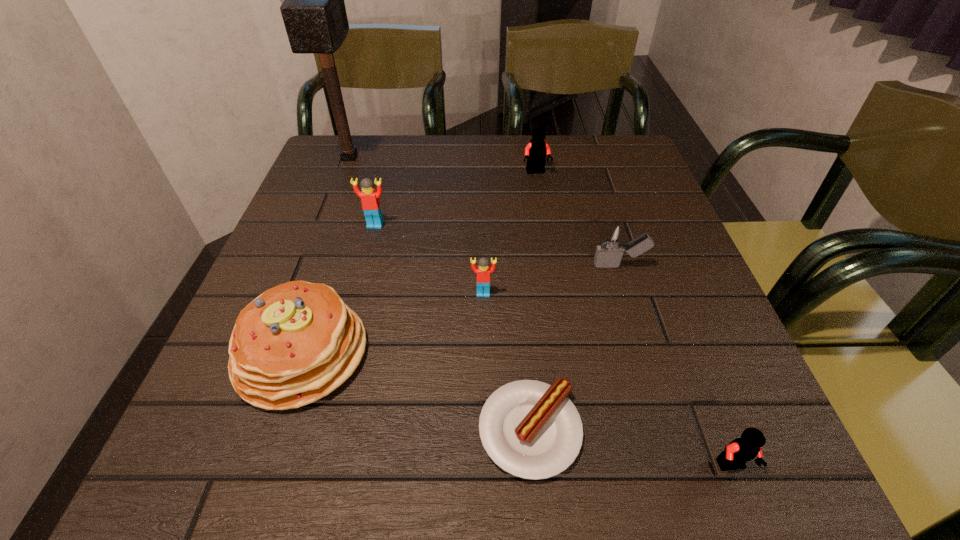
Identify the location of free area in between the igniter and the mallet. (485, 212).

Locate an element on the screen. vacant area between the gray igniter and the shortest object is located at coordinates (575, 348).

The height and width of the screenshot is (540, 960). Find the location of `the sixth closest object relative to the mallet`. the sixth closest object relative to the mallet is located at coordinates (530, 429).

Locate which object ranks seventh in proximity to the bigger black Lego. Please provide its 2D coordinates. Your answer should be formatted as a tuple, i.e. [(x, y)], where the tuple contains the x and y coordinates of a point satisfying the conditions above.

[(740, 450)]

Find the location of a particular element. Lego object that ranks as the third closest to the smaller black Lego is located at coordinates (369, 196).

Locate an element on the screen. This screenshot has height=540, width=960. the closest Lego to the pancake is located at coordinates (483, 270).

At what (x,y) coordinates should I click in order to perform the action: click on free space in the image that satisfies the following two spatial constraints: 1. on the face of the sausage; 2. on the right side of the right red Lego. Please return your answer as a coordinate pair (x, y). This screenshot has width=960, height=540. Looking at the image, I should click on (484, 430).

The width and height of the screenshot is (960, 540). Identify the location of free space that satisfies the following two spatial constraints: 1. on the face of the smaller red Lego; 2. on the right side of the shortest object. (484, 430).